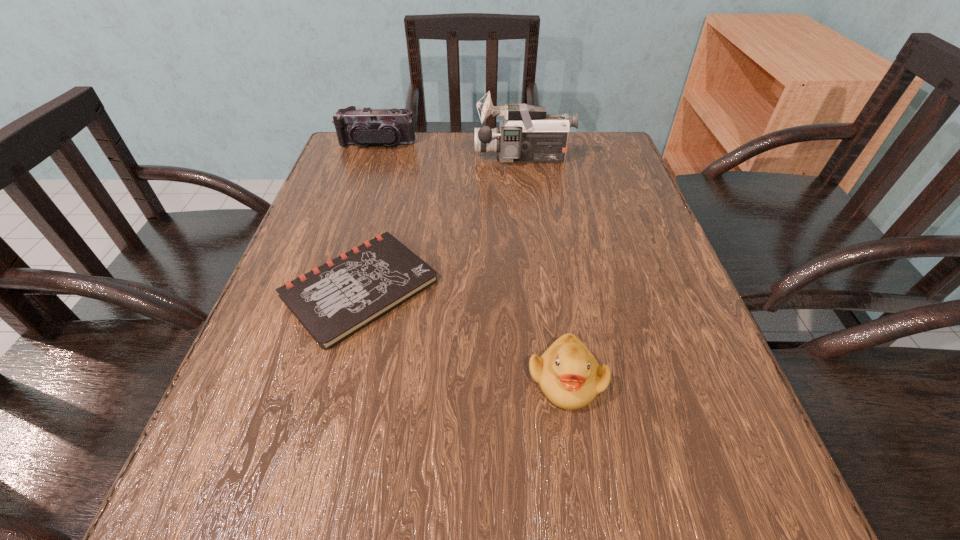
In order to click on the tallest object in this screenshot , I will do `click(527, 134)`.

The width and height of the screenshot is (960, 540). I want to click on the taller camcorder, so click(x=527, y=134).

Find the location of a particular element. the left camcorder is located at coordinates (366, 126).

I want to click on duckling, so click(x=568, y=374).

Find the location of a particular element. the shortest object is located at coordinates (337, 299).

Find the location of a particular element. This screenshot has height=540, width=960. blank area located 0.080m on the front-facing side of the tallest object is located at coordinates (444, 158).

Find the location of a particular element. This screenshot has height=540, width=960. free region located on the front-facing side of the tallest object is located at coordinates (432, 158).

This screenshot has height=540, width=960. I want to click on vacant space located 0.220m on the front-facing side of the tallest object, so click(389, 158).

Where is `vacant area located on the front-facing side of the shorter camcorder`? This screenshot has height=540, width=960. vacant area located on the front-facing side of the shorter camcorder is located at coordinates (365, 181).

Where is `blank space located on the front-facing side of the duckling`? The height and width of the screenshot is (540, 960). blank space located on the front-facing side of the duckling is located at coordinates (582, 479).